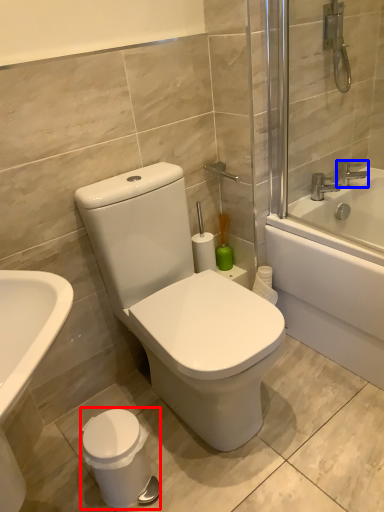
Question: Which object appears farthest to the camera in this image, porcelain (highlighted by a red box) or tap (highlighted by a blue box)?

Choices:
 (A) porcelain
 (B) tap

Answer: (B)